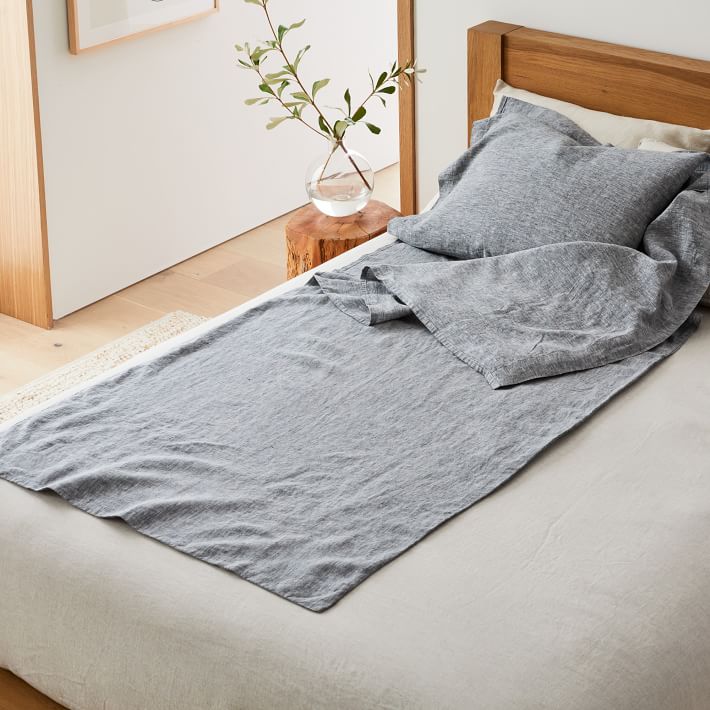
The image size is (710, 710). In order to click on pillow in this screenshot , I will do `click(567, 175)`, `click(610, 126)`, `click(649, 143)`.